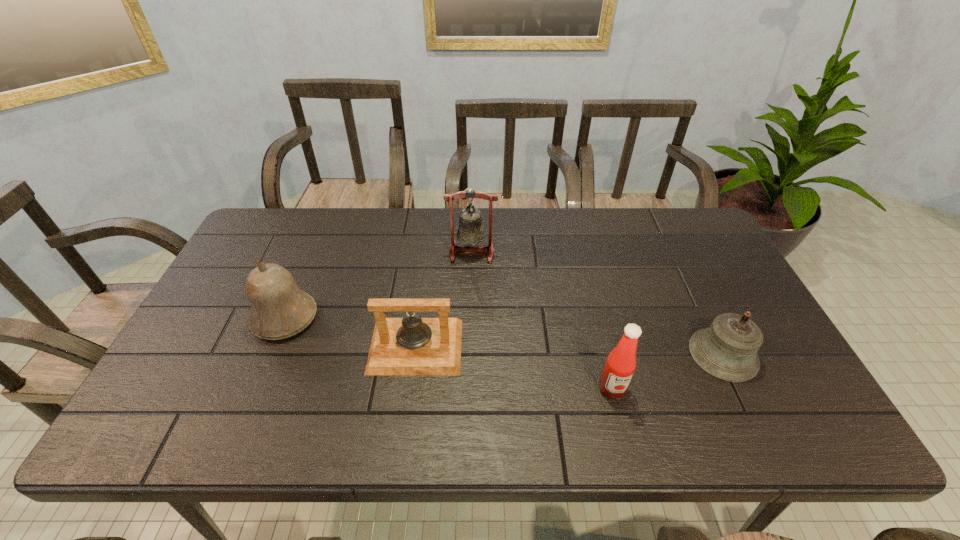
Identify the location of vacant space at the far edge of the desktop. This screenshot has width=960, height=540. (526, 217).

You are a GUI agent. You are given a task and a screenshot of the screen. Output one action in this format:
    pyautogui.click(x=<x>, y=<y>)
    Task: Click on the vacant area at the near edge
    
    Given the screenshot: What is the action you would take?
    pyautogui.click(x=488, y=431)

The width and height of the screenshot is (960, 540). What are the coordinates of `vacant space at the left edge of the desktop` in the screenshot? It's located at (198, 360).

The image size is (960, 540). In the image, there is a desktop. Identify the location of vacant space at the far left corner. (273, 248).

This screenshot has width=960, height=540. Identify the location of vacant space at the near left corner. (193, 423).

The height and width of the screenshot is (540, 960). I want to click on vacant area that lies between the farthest bell and the fourth object from left to right, so click(541, 320).

Locate an element on the screen. vacant region between the farthest bell and the leftmost object is located at coordinates (378, 285).

Identify the location of the third closest object relative to the farthest object. (620, 365).

Select which object is the closest to the leftmost object. Please provide its 2D coordinates. Your answer should be formatted as a tuple, i.e. [(x, y)], where the tuple contains the x and y coordinates of a point satisfying the conditions above.

[(411, 345)]

Point out which bell is positioned as the second nearest to the leftmost bell. Please provide its 2D coordinates. Your answer should be formatted as a tuple, i.e. [(x, y)], where the tuple contains the x and y coordinates of a point satisfying the conditions above.

[(470, 231)]